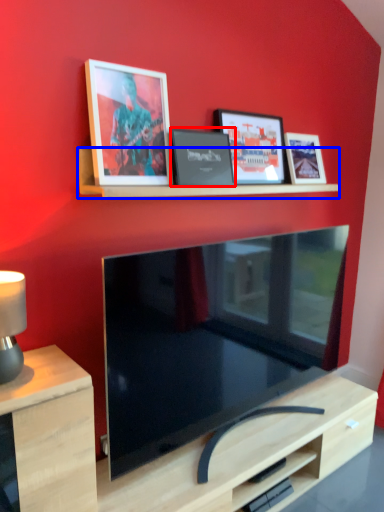
Question: Which object is further to the camera taking this photo, picture frame (highlighted by a red box) or shelf (highlighted by a blue box)?

Choices:
 (A) picture frame
 (B) shelf

Answer: (A)